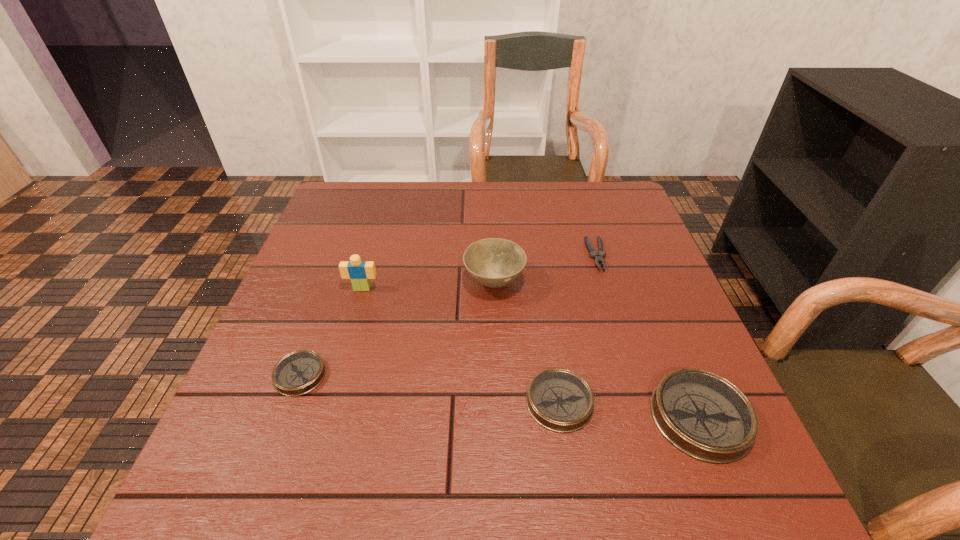
Locate an element on the screen. This screenshot has height=540, width=960. vacant space that is in between the fifth shortest object and the fourth tallest object is located at coordinates (527, 342).

The image size is (960, 540). I want to click on free space that is in between the leftmost compass and the pliers, so click(448, 315).

Where is `blank region between the rightmost compass and the second shortest object`? This screenshot has height=540, width=960. blank region between the rightmost compass and the second shortest object is located at coordinates (500, 396).

At what (x,y) coordinates should I click in order to perform the action: click on free space between the second tallest object and the tallest object. Please return your answer as a coordinate pair (x, y). This screenshot has height=540, width=960. Looking at the image, I should click on (428, 285).

The height and width of the screenshot is (540, 960). Identify the location of object that can be found as the third closest to the second shortest compass. (598, 257).

This screenshot has width=960, height=540. I want to click on object that is the fifth closest to the second compass from right to left, so click(359, 272).

Image resolution: width=960 pixels, height=540 pixels. I want to click on compass that is the closest to the tallest object, so click(297, 373).

Where is `the closest compass to the fifth shortest object`? This screenshot has width=960, height=540. the closest compass to the fifth shortest object is located at coordinates (560, 400).

The height and width of the screenshot is (540, 960). I want to click on free spot that satisfies the following two spatial constraints: 1. on the face of the third tallest object; 2. on the right side of the tallest object, so click(325, 417).

The height and width of the screenshot is (540, 960). What are the coordinates of `free space that satisfies the following two spatial constraints: 1. on the face of the Lego; 2. on the right side of the third shortest object` in the screenshot? It's located at (329, 402).